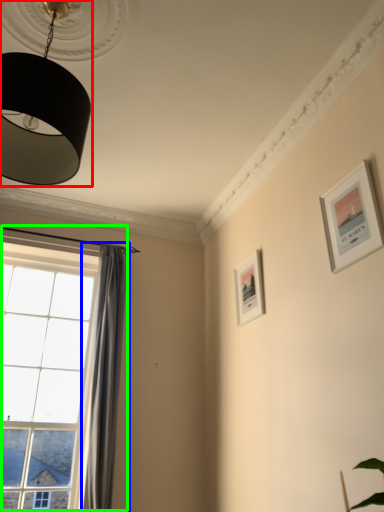
Question: Considering the real-world distances, which object is farthest from lamp (highlighted by a red box)? curtain (highlighted by a blue box) or window (highlighted by a green box)?

Choices:
 (A) curtain
 (B) window

Answer: (A)